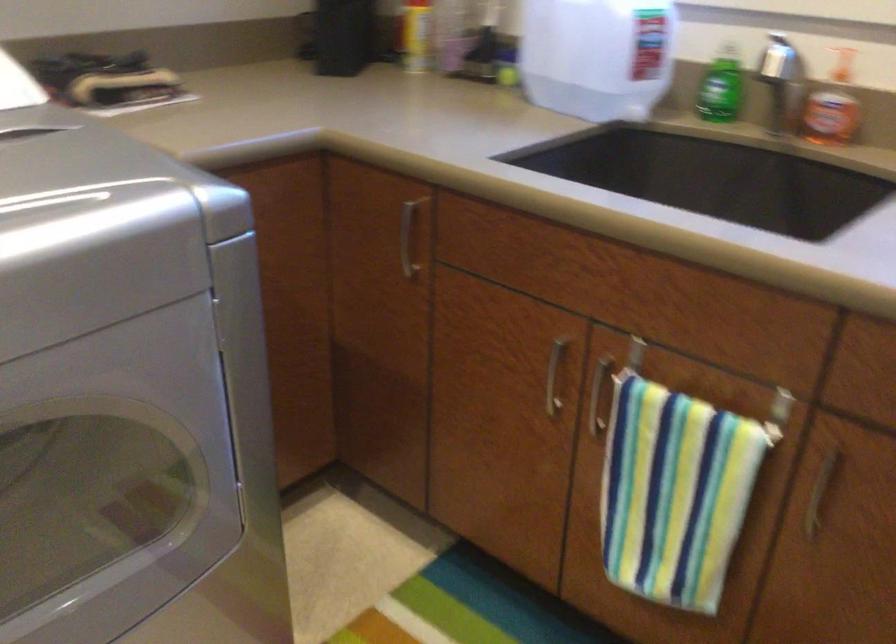
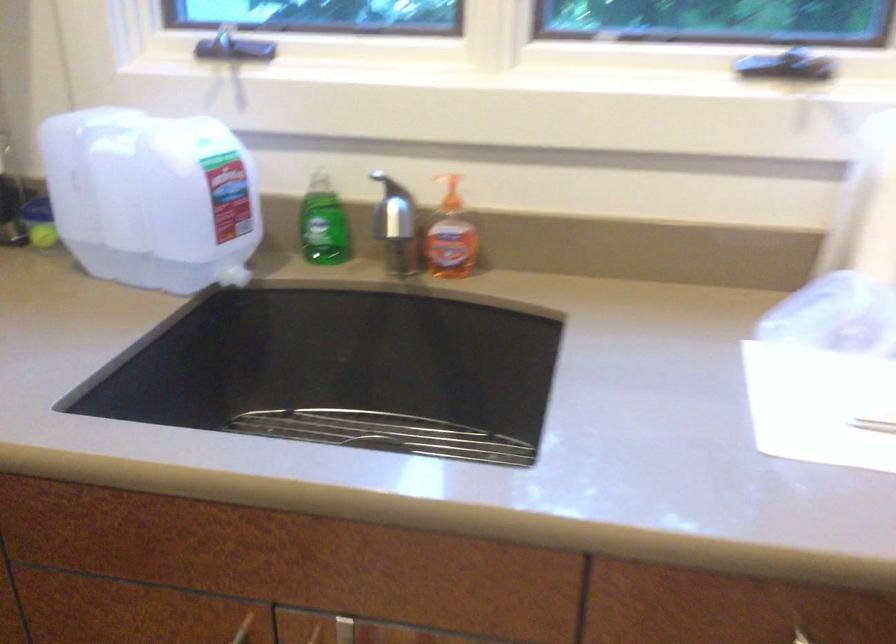
The point at (638,357) is marked in the first image. Where is the corresponding point in the second image?

(343, 630)